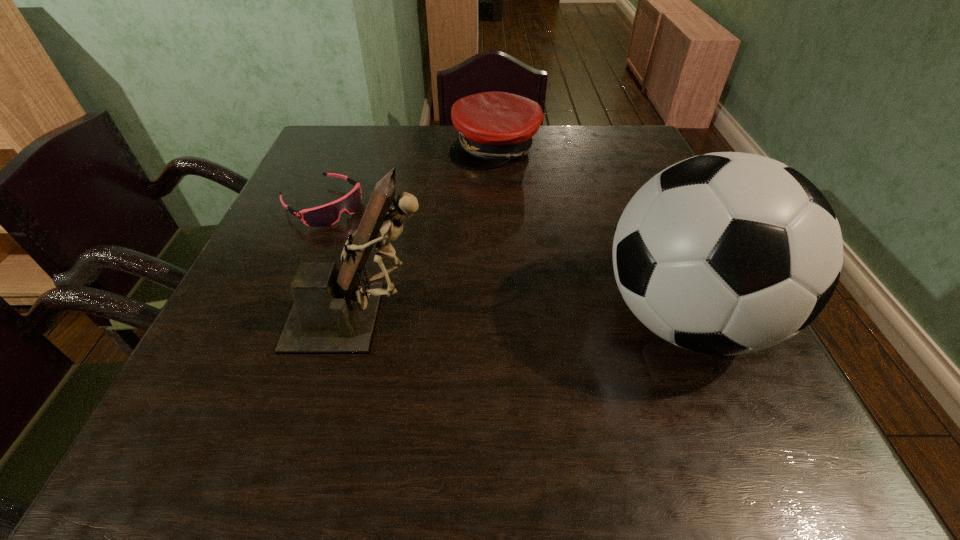
Image resolution: width=960 pixels, height=540 pixels. I want to click on free space located at the front of the third object from left to right where the visor is located, so click(x=491, y=198).

In order to click on vacant space located 0.100m on the front-facing side of the third nearest object in this screenshot , I will do `click(372, 240)`.

Identify the location of blank space located 0.260m on the front-facing side of the third nearest object. (420, 276).

I want to click on vacant space located on the front-facing side of the third nearest object, so click(463, 306).

Where is `object that is positioned at the far edge`? object that is positioned at the far edge is located at coordinates (494, 128).

Find the location of a particular element. figurine located in the near edge section of the desktop is located at coordinates (334, 312).

Where is `soccer ball situated at the near edge`? The height and width of the screenshot is (540, 960). soccer ball situated at the near edge is located at coordinates (727, 253).

The height and width of the screenshot is (540, 960). Find the location of `figurine positioned at the left edge`. figurine positioned at the left edge is located at coordinates (334, 312).

Where is `goggles that is positioned at the left edge`? This screenshot has width=960, height=540. goggles that is positioned at the left edge is located at coordinates (325, 215).

Find the location of a particular element. This screenshot has width=960, height=540. object that is at the right edge is located at coordinates click(x=727, y=253).